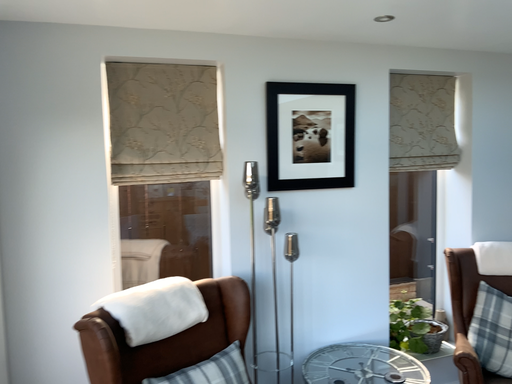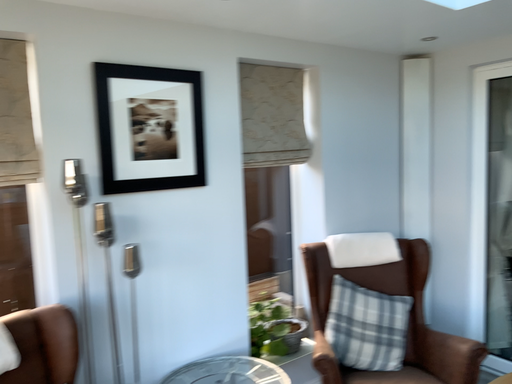
Question: How did the camera likely rotate when shooting the video?

Choices:
 (A) rotated right
 (B) rotated left

Answer: (A)